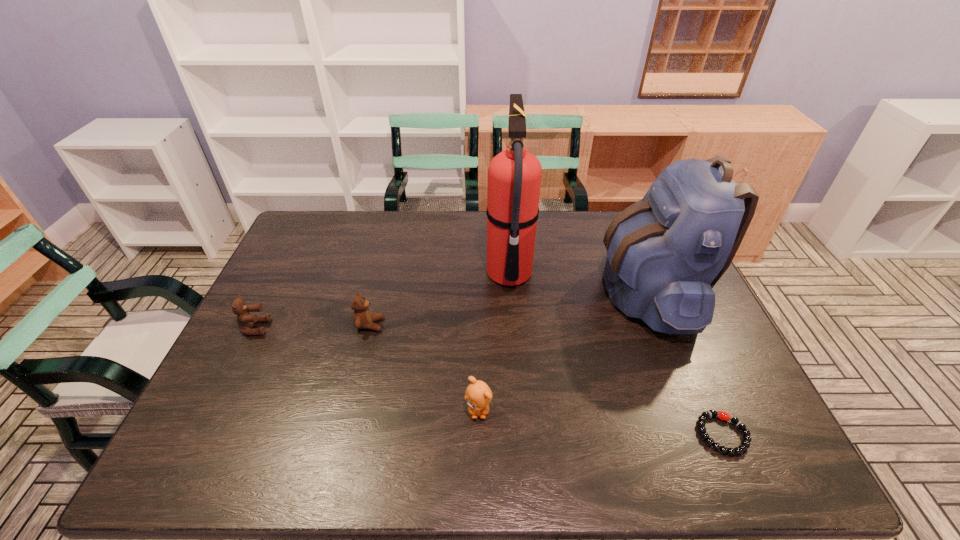
Identify the location of vacant area between the nearest teddy bear and the tallest object. point(493,342).

The height and width of the screenshot is (540, 960). What are the coordinates of `free point between the nearest teddy bear and the shortest object` in the screenshot? It's located at (601, 422).

This screenshot has height=540, width=960. In order to click on free space between the tallest object and the leftmost object in this screenshot , I will do `click(382, 301)`.

The width and height of the screenshot is (960, 540). What are the coordinates of `free space that is in between the second teddy bear from right to left and the shortest object` in the screenshot? It's located at (546, 379).

What are the coordinates of `empty space between the bracelet and the tallest object` in the screenshot? It's located at (616, 354).

The image size is (960, 540). What are the coordinates of `empty space that is in between the tallest object and the second tallest object` in the screenshot? It's located at (578, 282).

Select which object appears as the second closest to the fifth shortest object. Please provide its 2D coordinates. Your answer should be formatted as a tuple, i.e. [(x, y)], where the tuple contains the x and y coordinates of a point satisfying the conditions above.

[(514, 176)]

I want to click on the fourth closest object to the second teddy bear from right to left, so click(x=665, y=253).

This screenshot has height=540, width=960. I want to click on teddy bear that can be found as the second closest to the shortest object, so click(362, 317).

Identify the location of teddy bear object that ranks as the third closest to the shortest object. (245, 320).